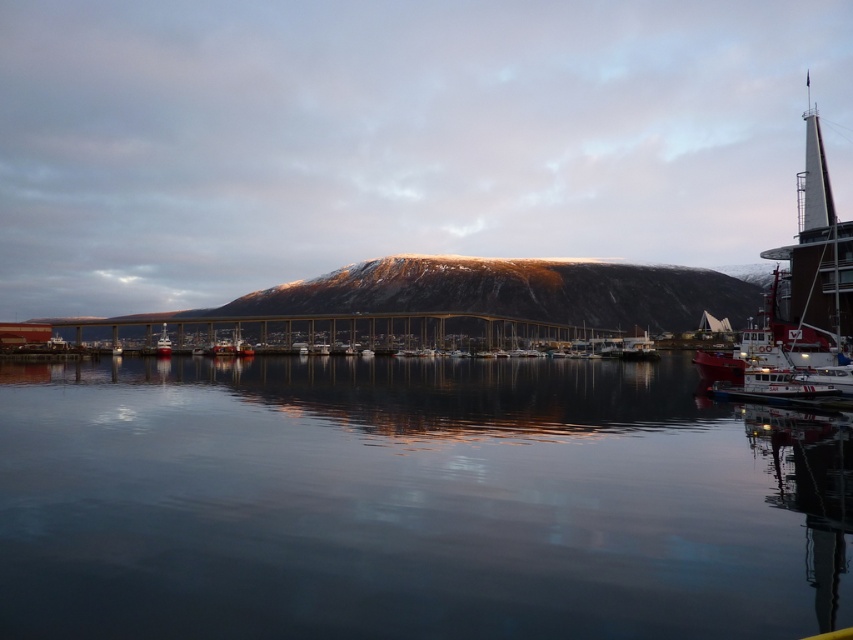
Question: Is smooth dark water at center behind red matte boat at right?

Choices:
 (A) yes
 (B) no

Answer: (B)

Question: Considering the relative positions of sandy brown rock at center and red matte boat at right in the image provided, where is sandy brown rock at center located with respect to red matte boat at right?

Choices:
 (A) left
 (B) right

Answer: (A)

Question: Which object is the closest to the white glossy boat at lower left?

Choices:
 (A) red matte boat at right
 (B) sandy brown rock at center

Answer: (A)

Question: Is smooth dark water at center to the right of shiny red boat at lower left from the viewer's perspective?

Choices:
 (A) yes
 (B) no

Answer: (A)

Question: Which point is closer to the camera?

Choices:
 (A) sandy brown rock at center
 (B) white glossy boat at lower left
 (C) shiny red boat at lower left
 (D) smooth dark water at center

Answer: (D)

Question: Among these points, which one is farthest from the camera?

Choices:
 (A) (111, 346)
 (B) (309, 284)
 (C) (161, 352)
 (D) (378, 544)

Answer: (B)